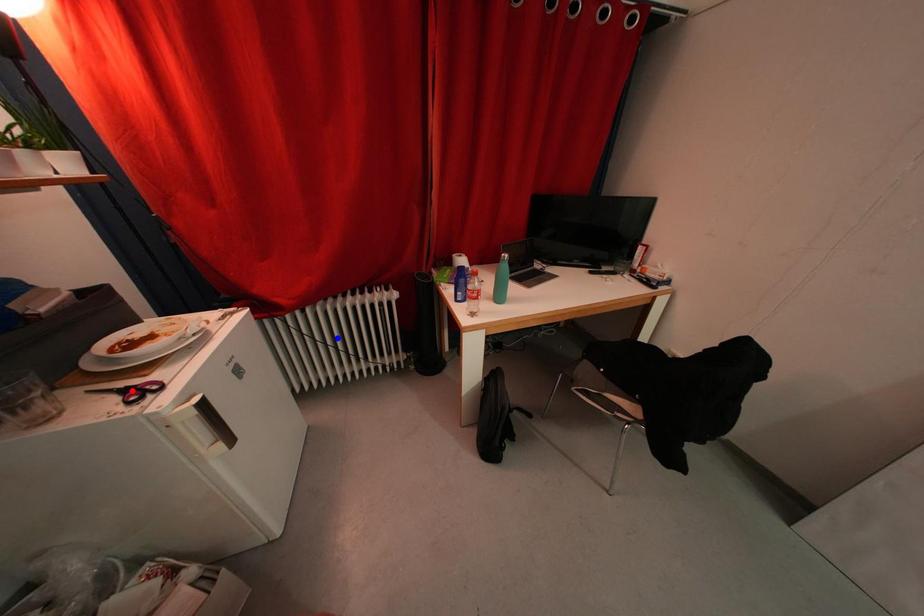
Question: Two points are marked on the image. Which point is closer to the camera?

Choices:
 (A) Blue point is closer.
 (B) Red point is closer.

Answer: (B)